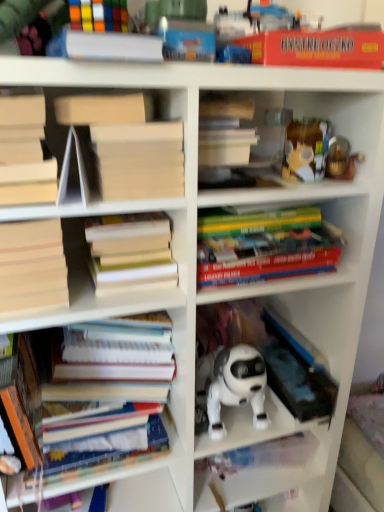
Question: From a real-world perspective, is rubberized plastic toy at upper center above or below white matte book at upper left, placed as the third book when sorted from top to bottom?

Choices:
 (A) below
 (B) above

Answer: (B)

Question: From the image's perspective, is rubberized plastic toy at upper center above or below white matte book at upper left, acting as the fifth book starting from the bottom?

Choices:
 (A) above
 (B) below

Answer: (A)

Question: Considering the real-world distances, which object is farthest from the hardcover books at left, the first book positioned from the bottom?

Choices:
 (A) hardcover books at center, which ranks as the 5th book in top-to-bottom order
 (B) red matte board game box at upper right, placed as the 1th paperback book when sorted from right to left
 (C) white matte book at upper left, placed as the third book when sorted from top to bottom
 (D) hardcover books at center, which is the fourth book in bottom-to-top order
 (E) hardcover book at center, the 6th book from the bottom

Answer: (B)

Question: Which is farther from the translucent plastic container at upper right, which is counted as the 1th toy, starting from the left?

Choices:
 (A) hardcover books at center, which is the fourth book from top to bottom
 (B) light brown cardboard book at left, which ranks as the 6th book in top-to-bottom order
 (C) hardcover books at center, which ranks as the 5th book in top-to-bottom order
 (D) white matte paper at upper center, positioned as the 2th paperback book in right-to-left order
 (E) rubberized plastic rubik's cube at upper left, which ranks as the seventh book in bottom-to-top order

Answer: (B)